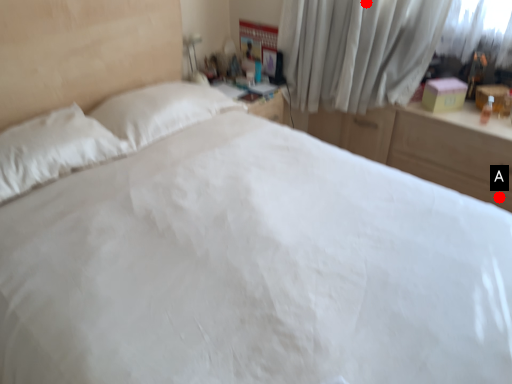
Question: Two points are circled on the image, labeled by A and B beside each circle. Which point is closer to the camera?

Choices:
 (A) A is closer
 (B) B is closer

Answer: (A)